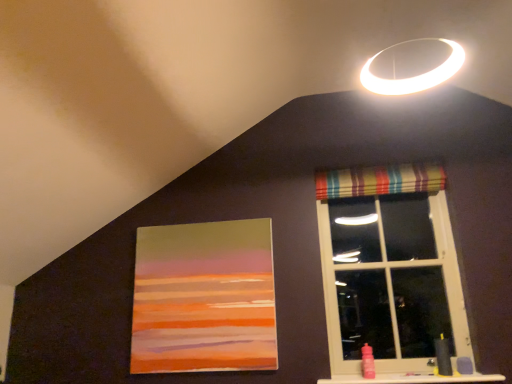
Question: From the image's perspective, is matte acrylic painting at center on top of yellow rubber sink at lower right?

Choices:
 (A) yes
 (B) no

Answer: (A)

Question: Is matte acrylic painting at center to the right of yellow rubber sink at lower right from the viewer's perspective?

Choices:
 (A) yes
 (B) no

Answer: (B)

Question: Is matte acrylic painting at center looking in the opposite direction of yellow rubber sink at lower right?

Choices:
 (A) yes
 (B) no

Answer: (B)

Question: Is matte acrylic painting at center not inside yellow rubber sink at lower right?

Choices:
 (A) no
 (B) yes

Answer: (B)

Question: Can you confirm if matte acrylic painting at center is bigger than yellow rubber sink at lower right?

Choices:
 (A) yes
 (B) no

Answer: (A)

Question: Considering the relative positions of matte acrylic painting at center and smooth plastic bottle at lower right in the image provided, is matte acrylic painting at center to the left or to the right of smooth plastic bottle at lower right?

Choices:
 (A) left
 (B) right

Answer: (A)

Question: From the image's perspective, is matte acrylic painting at center positioned above or below smooth plastic bottle at lower right?

Choices:
 (A) above
 (B) below

Answer: (A)

Question: From a real-world perspective, is matte acrylic painting at center physically located above or below smooth plastic bottle at lower right?

Choices:
 (A) below
 (B) above

Answer: (B)

Question: Is matte acrylic painting at center inside or outside of smooth plastic bottle at lower right?

Choices:
 (A) outside
 (B) inside

Answer: (A)

Question: From a real-world perspective, is smooth plastic bottle at lower right above or below yellow rubber sink at lower right?

Choices:
 (A) above
 (B) below

Answer: (B)

Question: Is smooth plastic bottle at lower right spatially inside yellow rubber sink at lower right, or outside of it?

Choices:
 (A) outside
 (B) inside

Answer: (A)

Question: In terms of height, does smooth plastic bottle at lower right look taller or shorter compared to yellow rubber sink at lower right?

Choices:
 (A) tall
 (B) short

Answer: (B)

Question: Considering the positions of smooth plastic bottle at lower right and yellow rubber sink at lower right in the image, is smooth plastic bottle at lower right bigger or smaller than yellow rubber sink at lower right?

Choices:
 (A) big
 (B) small

Answer: (A)

Question: From their relative heights in the image, would you say striped fabric curtain at upper right is taller or shorter than striped fabric window at upper right?

Choices:
 (A) short
 (B) tall

Answer: (A)

Question: From the image's perspective, is striped fabric curtain at upper right positioned above or below striped fabric window at upper right?

Choices:
 (A) below
 (B) above

Answer: (B)